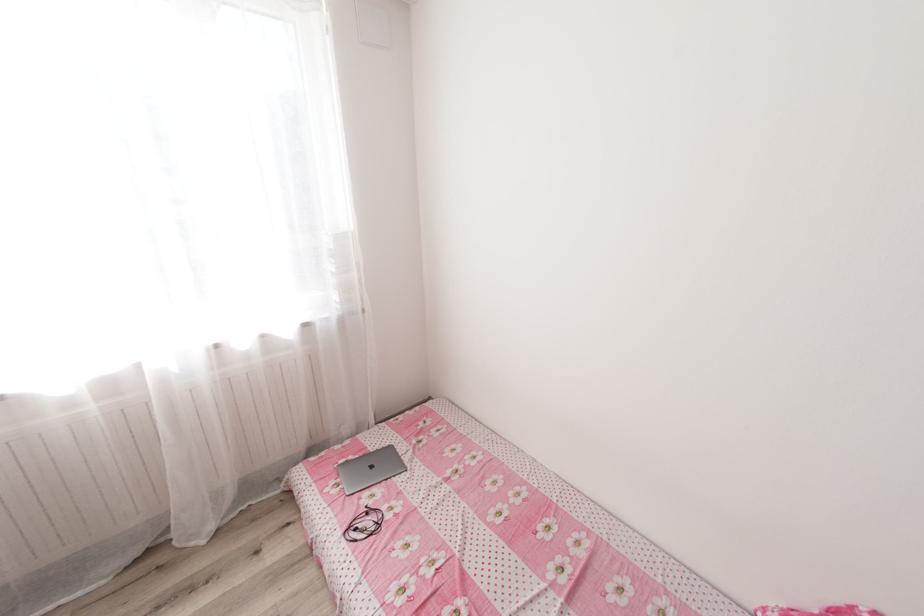
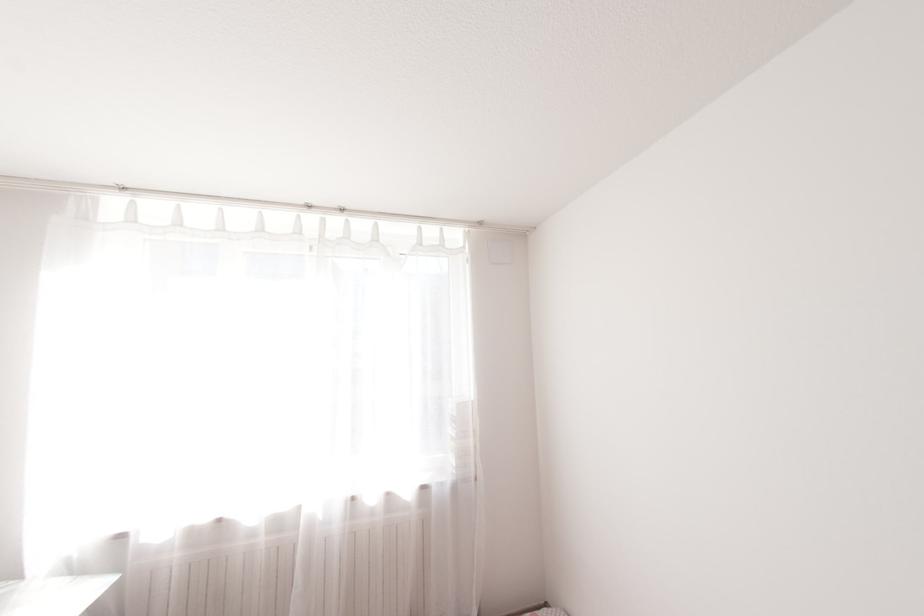
The images are taken continuously from a first-person perspective. In which direction is your viewpoint rotating?

The rotation direction of the camera is left-up.